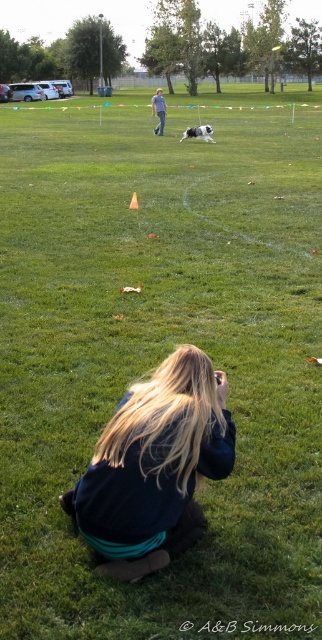
Can you confirm if blonde hair at lower center is positioned to the right of blue jeans at center?

Indeed, blonde hair at lower center is positioned on the right side of blue jeans at center.

Which is in front, point (101, 474) or point (157, 115)?

Point (101, 474) is in front.

Is point (106, 424) in front of point (161, 115)?

Yes, it is.

Identify the location of blonde hair at lower center. (154, 467).